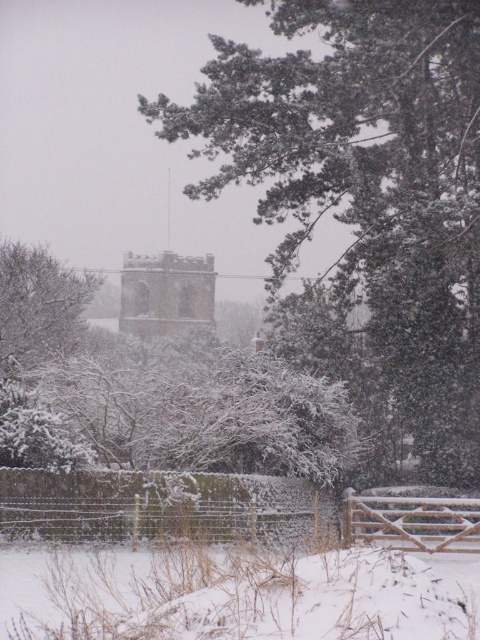
Looking at this image, does snow-covered tree at center appear on the right side of snow-covered wooden fence at lower center?

No, snow-covered tree at center is not to the right of snow-covered wooden fence at lower center.

Which of these two, snow-covered tree at center or snow-covered wooden fence at lower center, stands shorter?

Standing shorter between the two is snow-covered wooden fence at lower center.

Is point (47, 456) positioned behind point (167, 476)?

No, (47, 456) is closer to viewer.

Find the location of a particular element. The image size is (480, 640). snow-covered tree at center is located at coordinates (155, 392).

Locate an element on the screen. Image resolution: width=480 pixels, height=640 pixels. green textured tree at upper center is located at coordinates (368, 184).

Is point (457, 86) farther from viewer compared to point (37, 397)?

Yes.

Where is `green textured tree at upper center`? The width and height of the screenshot is (480, 640). green textured tree at upper center is located at coordinates (368, 184).

In the scene shown: Does green textured tree at upper center have a greater height compared to brown stone tower at center?

Yes.

Which is below, green textured tree at upper center or brown stone tower at center?

brown stone tower at center is lower down.

Who is more distant from viewer, (388,333) or (135,326)?

Positioned behind is point (135,326).

At what (x,y) coordinates should I click in order to perform the action: click on green textured tree at upper center. Please return your answer as a coordinate pair (x, y). The width and height of the screenshot is (480, 640). Looking at the image, I should click on (368, 184).